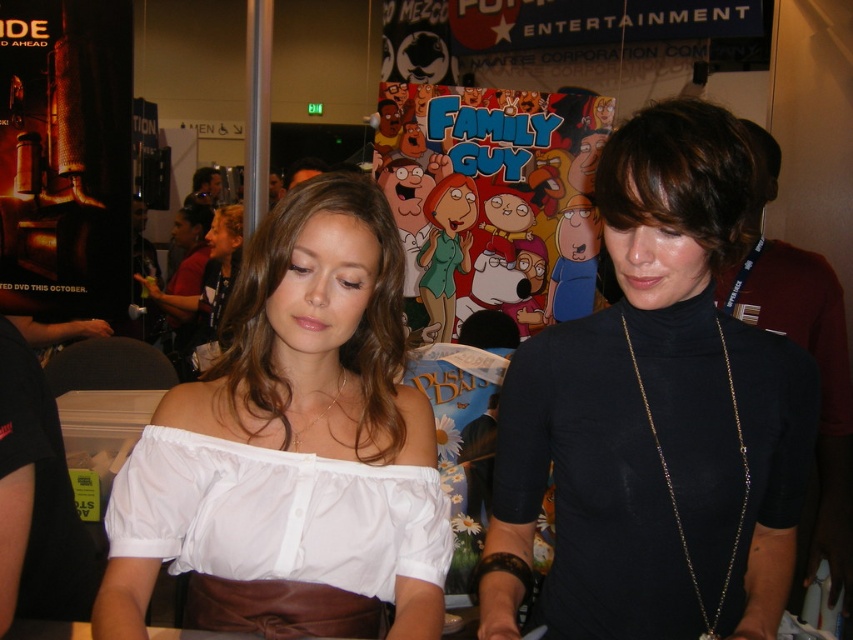
Question: Which is farther from the white satin dress at center?

Choices:
 (A) black matte turtleneck at center
 (B) cartoon characters at center
 (C) dark brown hair at center

Answer: (B)

Question: Considering the relative positions of cartoon characters at center and dark brown hair at center in the image provided, where is cartoon characters at center located with respect to dark brown hair at center?

Choices:
 (A) right
 (B) left

Answer: (B)

Question: Which point is farther to the camera?

Choices:
 (A) white satin dress at center
 (B) black matte turtleneck at center
 (C) cartoon characters at center
 (D) white satin blouse at center

Answer: (C)

Question: Does black matte turtleneck at center have a larger size compared to cartoon characters at center?

Choices:
 (A) yes
 (B) no

Answer: (B)

Question: Among these objects, which one is farthest from the camera?

Choices:
 (A) white cotton blouse at center
 (B) black matte turtleneck at center

Answer: (A)

Question: Can you confirm if black matte turtleneck at center is positioned below white cotton blouse at center?

Choices:
 (A) yes
 (B) no

Answer: (B)